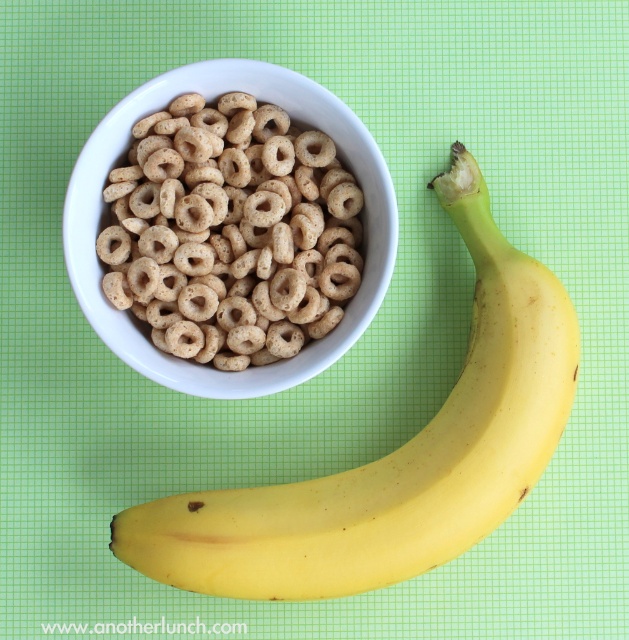
Question: Does yellow smooth banana at lower right lie in front of brown matte cereal loops at center?

Choices:
 (A) no
 (B) yes

Answer: (B)

Question: Among these objects, which one is nearest to the camera?

Choices:
 (A) brown matte cereal loops at center
 (B) yellow smooth banana at lower right

Answer: (B)

Question: Where is yellow smooth banana at lower right located in relation to brown matte cereal loops at center in the image?

Choices:
 (A) right
 (B) left

Answer: (A)

Question: Which point is farther to the camera?

Choices:
 (A) (247, 291)
 (B) (482, 324)

Answer: (A)

Question: Which point is farther to the camera?

Choices:
 (A) brown matte cereal loops at center
 (B) yellow smooth banana at lower right

Answer: (A)

Question: Can you confirm if yellow smooth banana at lower right is wider than brown matte cereal loops at center?

Choices:
 (A) yes
 (B) no

Answer: (A)